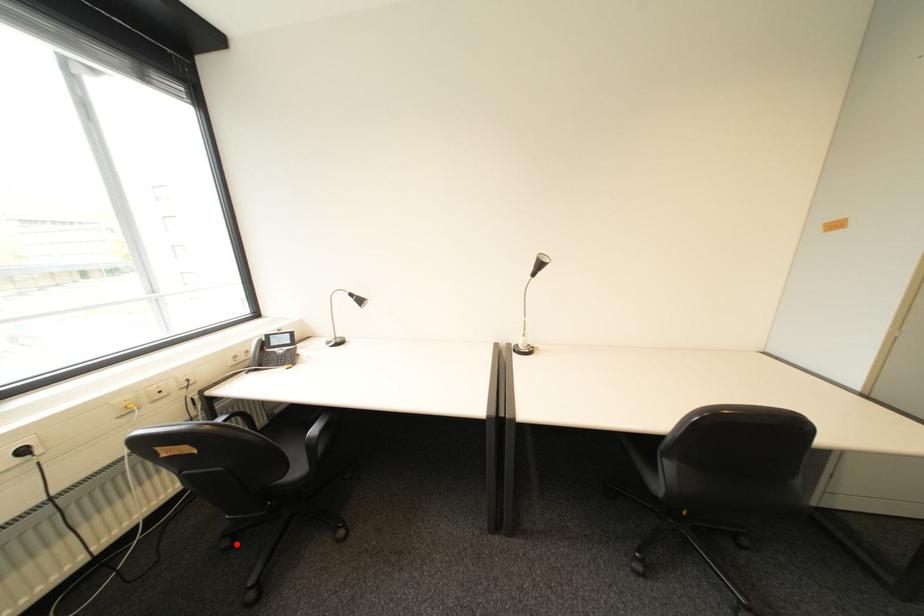
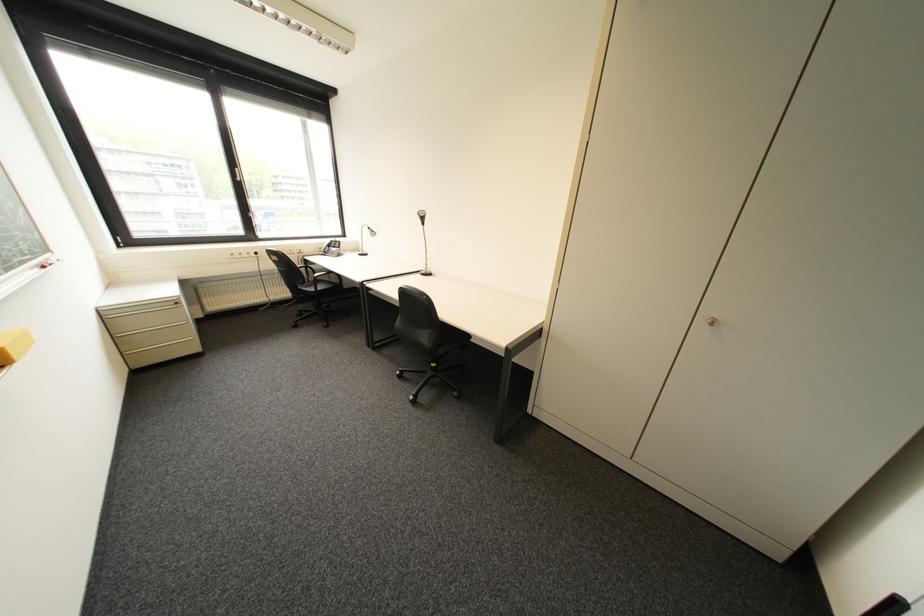
Question: I am providing you with two images of the same scene from different viewpoints. Image1 has a red point marked. In image2, the corresponding 3D location appears at what relative position? Reply with the corresponding letter.

Choices:
 (A) Closer
 (B) Farther

Answer: (A)